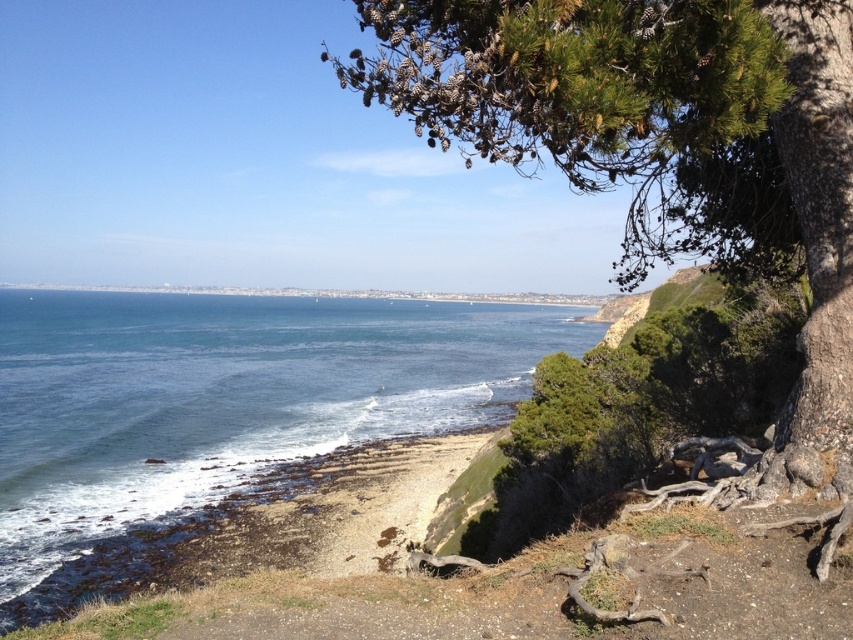
Does green pinecone-covered tree at upper right appear over blue water at center?

Yes.

Does point (529, 22) come closer to viewer compared to point (45, 474)?

Yes, it is.

At what (x,y) coordinates should I click in order to perform the action: click on green pinecone-covered tree at upper right. Please return your answer as a coordinate pair (x, y). This screenshot has height=640, width=853. Looking at the image, I should click on (664, 145).